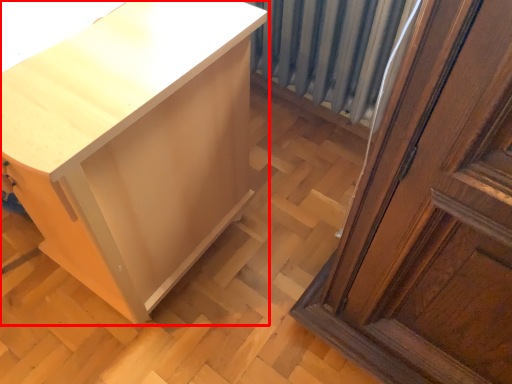
Question: In this image, where is furniture (annotated by the red box) located relative to radiator?

Choices:
 (A) right
 (B) left

Answer: (B)